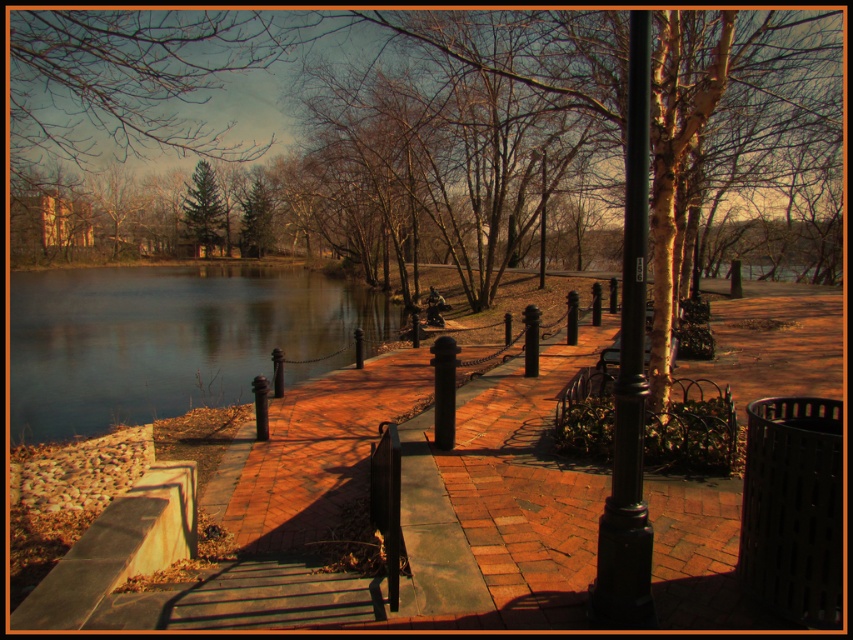
You are a park visitor who wants to take a photo of the smooth water at center and the green matte tree at upper center. Which object will appear larger in the photo?

The green matte tree at upper center will appear larger in the photo because it is taller than the smooth water at center.

You are a photographer standing on the paved brick pathway in the park. You want to capture a photo that includes both the smooth water at center and the green matte tree at upper center. Based on their positions, which object should you adjust your camera to focus on first to ensure both are in the frame?

The smooth water at center is to the left of green matte tree at upper center, so you should focus on the green matte tree at upper center first to ensure both objects are included in the frame.

You are a photographer standing on the paved brick pathway in the park. You want to capture a photo that includes both the smooth water at center and the green textured pine tree at upper center. Based on their positions, where should you position yourself to ensure both are in the frame?

The smooth water at center is below the green textured pine tree at upper center, so positioning yourself somewhere along the path between them or slightly behind the pine tree would allow both elements to be captured in the frame.